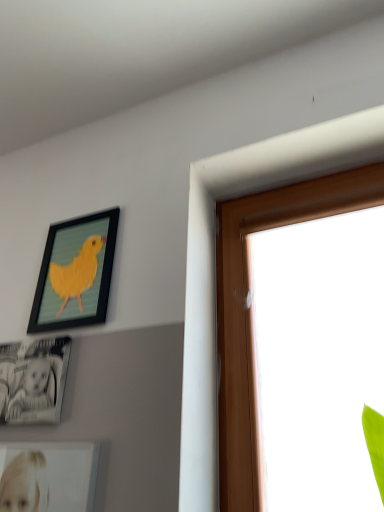
Question: In terms of width, does black glossy photo frame at lower left, which appears as the first picture frame when ordered from the bottom, look wider or thinner when compared to matte black picture frame at upper left, the 1th picture frame in the top-to-bottom sequence?

Choices:
 (A) thin
 (B) wide

Answer: (B)

Question: Considering their positions, is black glossy photo frame at lower left, which ranks as the 2th picture frame in top-to-bottom order, located in front of or behind matte black picture frame at upper left, the 1th picture frame in the top-to-bottom sequence?

Choices:
 (A) behind
 (B) front

Answer: (B)

Question: From a real-world perspective, relative to matte black picture frame at upper left, marked as the 2th picture frame in a bottom-to-top arrangement, is black glossy photo frame at lower left, which ranks as the 2th picture frame in top-to-bottom order, vertically above or below?

Choices:
 (A) above
 (B) below

Answer: (B)

Question: Looking at their shapes, would you say matte black picture frame at upper left, the 1th picture frame in the top-to-bottom sequence, is wider or thinner than black glossy photo frame at lower left, which ranks as the 2th picture frame in top-to-bottom order?

Choices:
 (A) thin
 (B) wide

Answer: (A)

Question: From a real-world perspective, relative to black glossy photo frame at lower left, which appears as the first picture frame when ordered from the bottom, is matte black picture frame at upper left, marked as the 2th picture frame in a bottom-to-top arrangement, vertically above or below?

Choices:
 (A) above
 (B) below

Answer: (A)

Question: Is matte black picture frame at upper left, marked as the 2th picture frame in a bottom-to-top arrangement, spatially inside black glossy photo frame at lower left, which appears as the first picture frame when ordered from the bottom, or outside of it?

Choices:
 (A) outside
 (B) inside

Answer: (A)

Question: Does point (92, 289) appear closer or farther from the camera than point (29, 389)?

Choices:
 (A) closer
 (B) farther

Answer: (B)